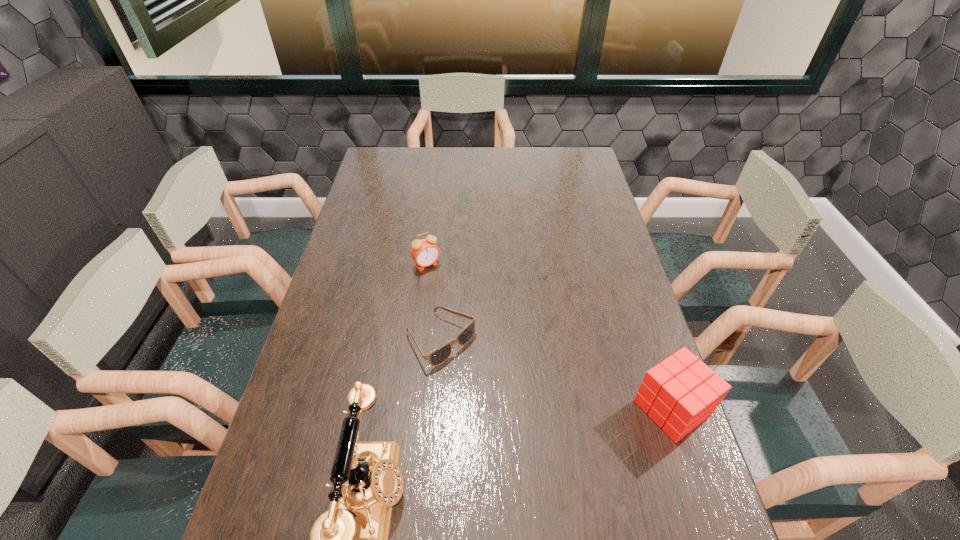
Locate an element on the screen. This screenshot has height=540, width=960. vacant area that lies between the cube and the farthest object is located at coordinates (549, 336).

Where is `free space between the alarm clock and the third nearest object`? This screenshot has height=540, width=960. free space between the alarm clock and the third nearest object is located at coordinates (434, 302).

At what (x,y) coordinates should I click in order to perform the action: click on vacant area that lies between the rightmost object and the third nearest object. Please return your answer as a coordinate pair (x, y). The image size is (960, 540). Looking at the image, I should click on (556, 374).

Locate which object ranks third in proximity to the sunglasses. Please provide its 2D coordinates. Your answer should be formatted as a tuple, i.e. [(x, y)], where the tuple contains the x and y coordinates of a point satisfying the conditions above.

[(680, 393)]

Locate which object is the third closest to the alarm clock. Please provide its 2D coordinates. Your answer should be formatted as a tuple, i.e. [(x, y)], where the tuple contains the x and y coordinates of a point satisfying the conditions above.

[(680, 393)]